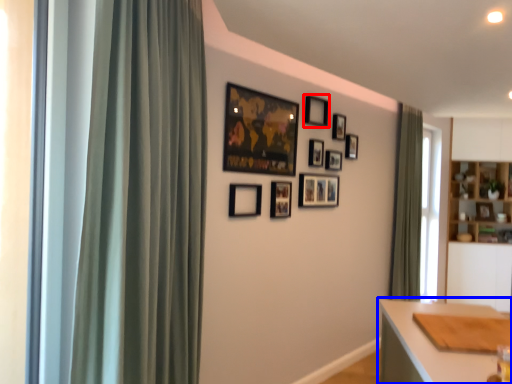
Question: Which point is closer to the camera, picture frame (highlighted by a red box) or table (highlighted by a blue box)?

Choices:
 (A) picture frame
 (B) table

Answer: (B)